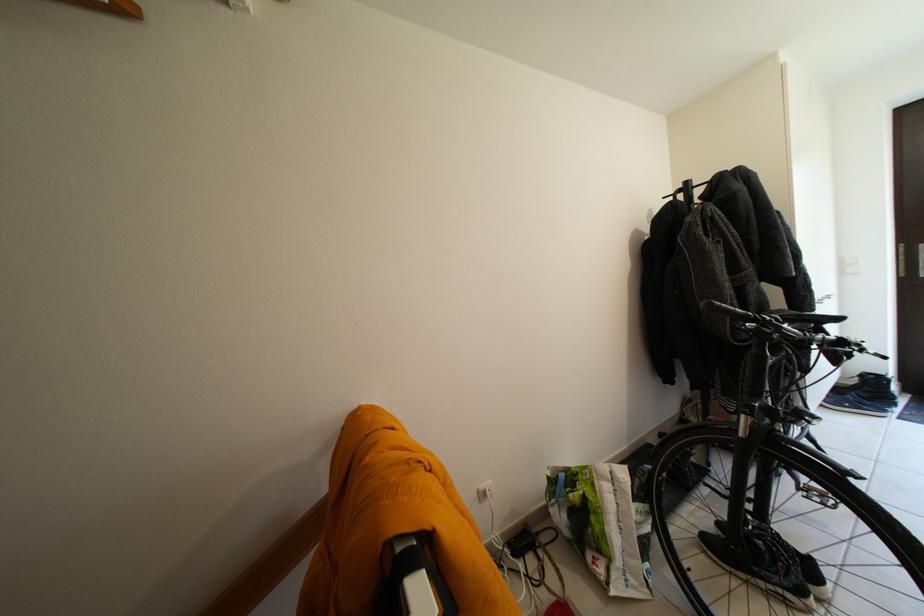
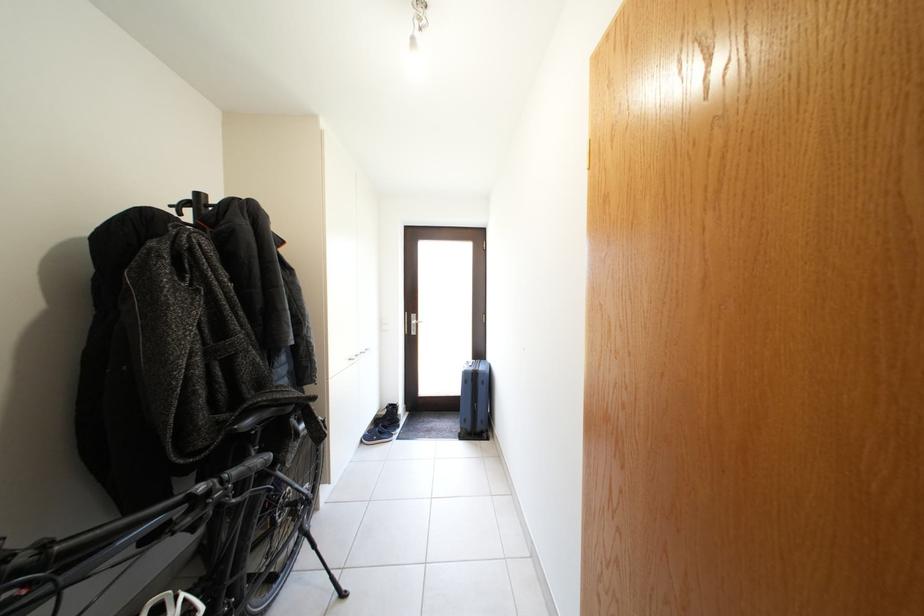
Where in the second image is the point corresponding to [869,400] from the first image?

(392, 431)